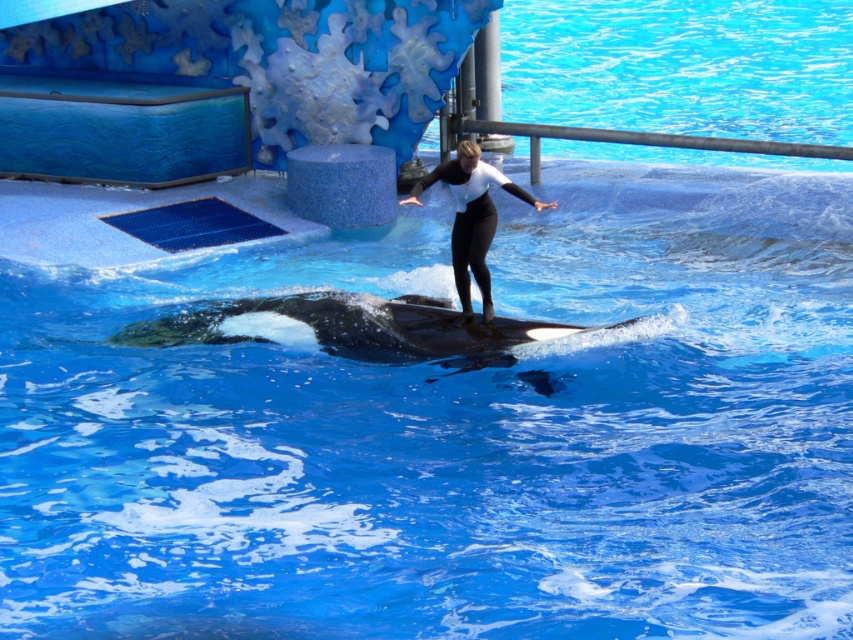
Between point (320, 339) and point (482, 196), which one is positioned in front?

Point (320, 339)

Can you confirm if black smooth whale at center is taller than black matte wetsuit at center?

Incorrect, black smooth whale at center's height is not larger of black matte wetsuit at center's.

Describe the element at coordinates (351, 326) in the screenshot. The height and width of the screenshot is (640, 853). I see `black smooth whale at center` at that location.

At what (x,y) coordinates should I click in order to perform the action: click on black smooth whale at center. Please return your answer as a coordinate pair (x, y). The image size is (853, 640). Looking at the image, I should click on coord(351,326).